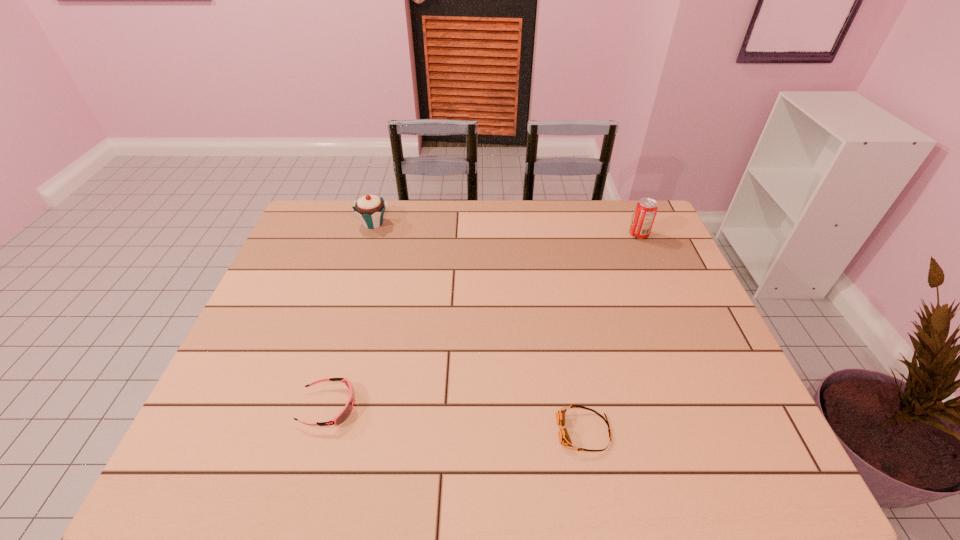
Find the location of a particular element. the rightmost object is located at coordinates (646, 209).

You are a GUI agent. You are given a task and a screenshot of the screen. Output one action in this format:
    pyautogui.click(x=<x>, y=<y>)
    Task: Click on the cupcake
    The width and height of the screenshot is (960, 540).
    Given the screenshot: What is the action you would take?
    pyautogui.click(x=370, y=209)

The height and width of the screenshot is (540, 960). In order to click on the left goggles in this screenshot , I will do `click(346, 411)`.

Identify the location of the shorter goggles. The width and height of the screenshot is (960, 540). (564, 438).

Locate an element on the screen. The width and height of the screenshot is (960, 540). the right goggles is located at coordinates (564, 438).

This screenshot has width=960, height=540. Find the location of `vacant space located on the front of the soda`. vacant space located on the front of the soda is located at coordinates pos(656,274).

At what (x,y) coordinates should I click in order to perform the action: click on free region located on the front of the cupcake. Please return your answer as a coordinate pair (x, y). The height and width of the screenshot is (540, 960). Looking at the image, I should click on (365, 251).

The width and height of the screenshot is (960, 540). I want to click on free space located 0.240m on the front-facing side of the left goggles, so click(x=461, y=406).

The width and height of the screenshot is (960, 540). What are the coordinates of `free spot located 0.290m with the lenses facing forward on the right goggles` in the screenshot? It's located at (424, 431).

The width and height of the screenshot is (960, 540). Find the location of `vacant space positioned 0.380m with the lenses facing forward on the right goggles`. vacant space positioned 0.380m with the lenses facing forward on the right goggles is located at coordinates (383, 431).